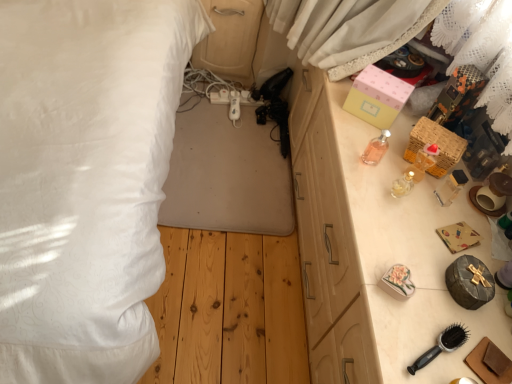
The height and width of the screenshot is (384, 512). In order to click on vacant region above wooden drawer at right (from a real-world perspective) in this screenshot , I will do `click(424, 213)`.